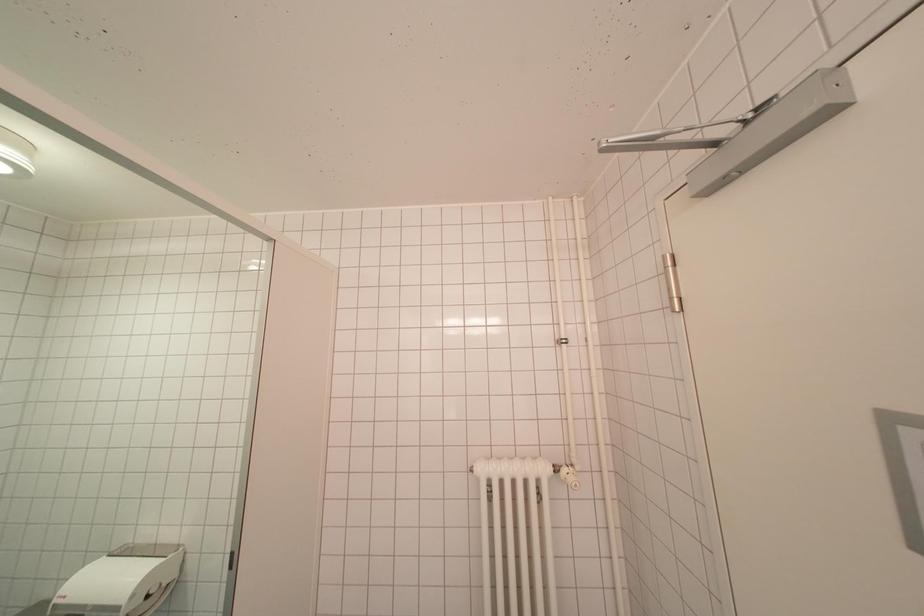
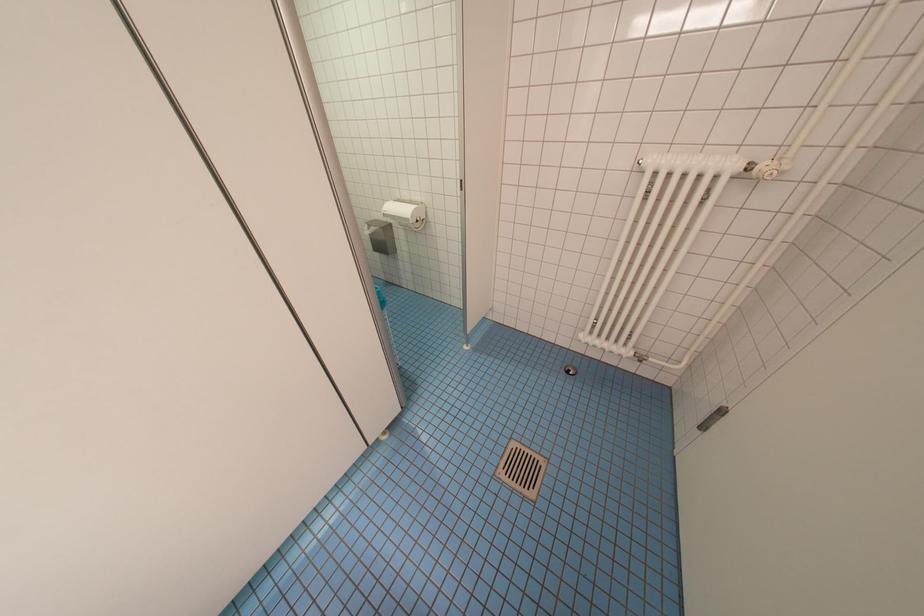
First-person continuous shooting, in which direction is the camera rotating?

The rotation direction of the camera is left-down.